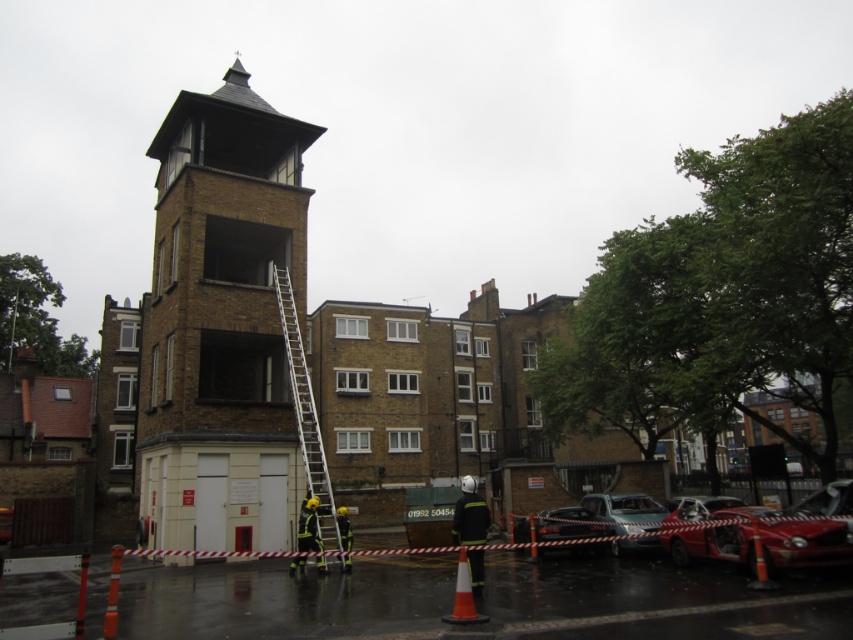
You are a delivery driver trying to park your truck in the parking area behind the building. The parking area is a rectangle with coordinates from point A at lower left corner to point B at upper right corner. The coordinates of point A are at 0.666, 0.666 and point B at 0.999, 0.999. Can you park your truck there without hitting the damaged red car at lower right?

The damaged red car at lower right is located at point [758,532], which is within the parking area defined by point A at [567,426] and point B at [851,639]. Therefore, parking the truck there may result in a collision with the damaged red car at lower right.

You are a firefighter assessing the scene. You see the damaged red car at lower right and the metallic silver ladder at center. Which object is shorter?

The damaged red car at lower right is shorter than the metallic silver ladder at center.